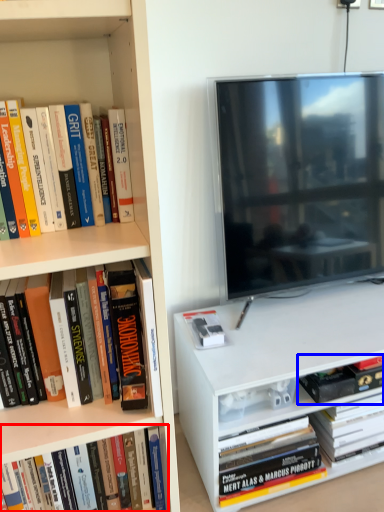
Question: Which point is further to the camera, book (highlighted by a red box) or book (highlighted by a blue box)?

Choices:
 (A) book
 (B) book

Answer: (B)